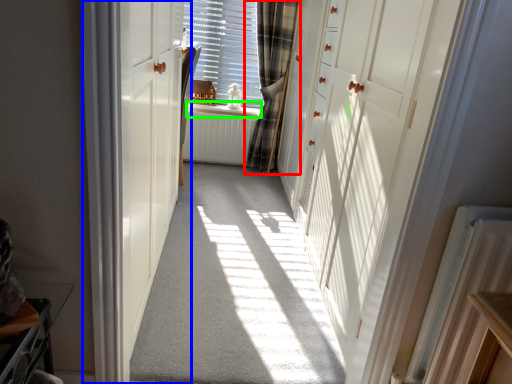
Question: Based on their relative distances, which object is nearer to curtain (highlighted by a red box)? Choose from door (highlighted by a blue box) and window sill (highlighted by a green box).

Choices:
 (A) door
 (B) window sill

Answer: (B)